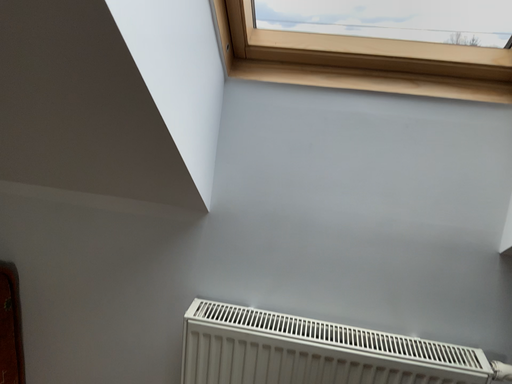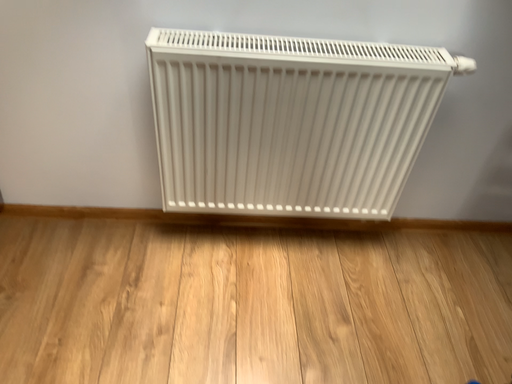
Question: How did the camera likely rotate when shooting the video?

Choices:
 (A) rotated left
 (B) rotated right

Answer: (B)